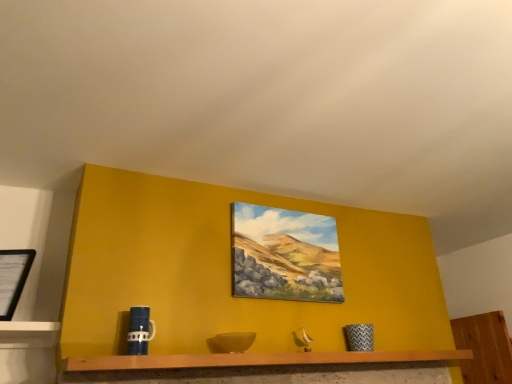
Question: Is blue matte mug at lower left looking in the opposite direction of matte canvas painting at center, which ranks as the 1th picture frame in right-to-left order?

Choices:
 (A) no
 (B) yes

Answer: (A)

Question: From a real-world perspective, is blue matte mug at lower left beneath matte canvas painting at center, which is the 2th picture frame from left to right?

Choices:
 (A) no
 (B) yes

Answer: (B)

Question: Is blue matte mug at lower left taller than matte canvas painting at center, which is the 2th picture frame from left to right?

Choices:
 (A) yes
 (B) no

Answer: (B)

Question: Is blue matte mug at lower left not inside matte canvas painting at center, arranged as the first picture frame when viewed from the back?

Choices:
 (A) no
 (B) yes

Answer: (B)

Question: From the image's perspective, is blue matte mug at lower left located above matte canvas painting at center, which ranks as the 1th picture frame in right-to-left order?

Choices:
 (A) no
 (B) yes

Answer: (A)

Question: Is blue matte mug at lower left directly adjacent to matte canvas painting at center, the second picture frame in the front-to-back sequence?

Choices:
 (A) no
 (B) yes

Answer: (A)

Question: Considering the relative positions of black matte picture frame at left, the 1th picture frame viewed from the left, and wooden shelf at center in the image provided, is black matte picture frame at left, the 1th picture frame viewed from the left, to the right of wooden shelf at center from the viewer's perspective?

Choices:
 (A) yes
 (B) no

Answer: (B)

Question: Does black matte picture frame at left, the second picture frame viewed from the back, have a smaller size compared to wooden shelf at center?

Choices:
 (A) no
 (B) yes

Answer: (B)

Question: Is there a large distance between black matte picture frame at left, the 1th picture frame viewed from the left, and wooden shelf at center?

Choices:
 (A) yes
 (B) no

Answer: (B)

Question: Considering the relative positions of black matte picture frame at left, the first picture frame positioned from the front, and wooden shelf at center in the image provided, is black matte picture frame at left, the first picture frame positioned from the front, in front of wooden shelf at center?

Choices:
 (A) no
 (B) yes

Answer: (A)

Question: Is black matte picture frame at left, the second picture frame viewed from the back, directly adjacent to wooden shelf at center?

Choices:
 (A) yes
 (B) no

Answer: (B)

Question: Is black matte picture frame at left, the 1th picture frame viewed from the left, oriented away from wooden shelf at center?

Choices:
 (A) no
 (B) yes

Answer: (A)

Question: Is blue matte mug at lower left with black matte picture frame at left, the 1th picture frame viewed from the left?

Choices:
 (A) no
 (B) yes

Answer: (A)